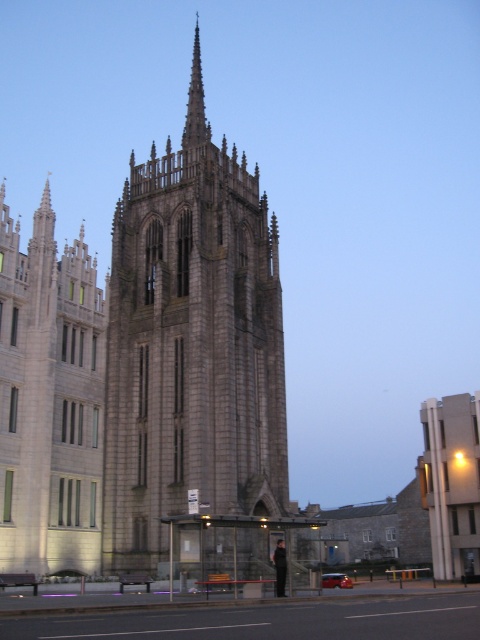
Question: Which of the following is the farthest from the observer?

Choices:
 (A) (251, 348)
 (B) (203, 132)
 (C) (280, 545)

Answer: (B)

Question: Does gray stone tower at center have a lesser width compared to black leather jacket at center?

Choices:
 (A) yes
 (B) no

Answer: (B)

Question: Does gray stone tower at center come behind black leather jacket at center?

Choices:
 (A) yes
 (B) no

Answer: (B)

Question: Estimate the real-world distances between objects in this image. Which object is closer to the black leather jacket at center?

Choices:
 (A) gray stone spire at center
 (B) gray stone tower at center

Answer: (B)

Question: Estimate the real-world distances between objects in this image. Which object is farther from the gray stone spire at center?

Choices:
 (A) gray stone tower at center
 (B) black leather jacket at center

Answer: (B)

Question: Is gray stone tower at center below gray stone spire at center?

Choices:
 (A) no
 (B) yes

Answer: (B)